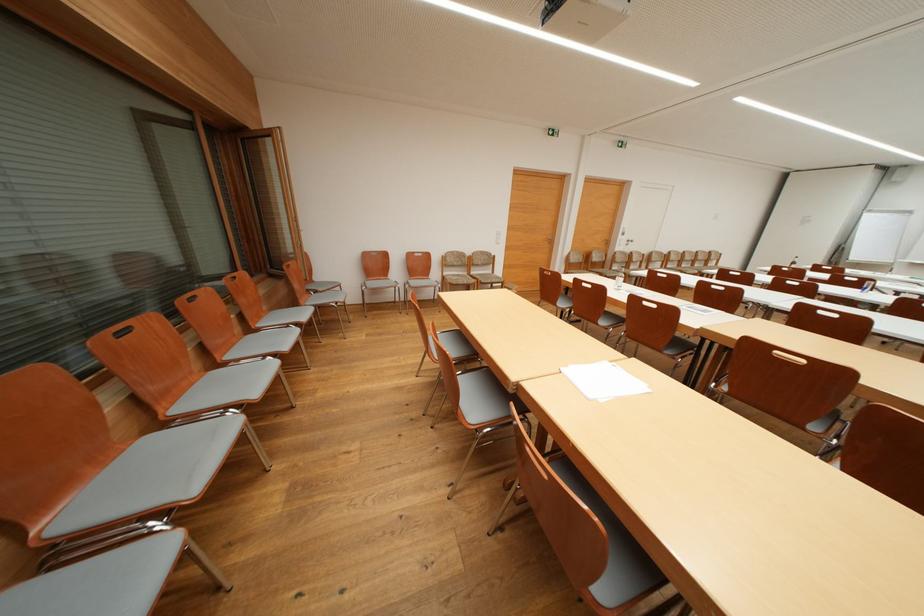
Locate an element on the screen. window handle is located at coordinates (295, 219).